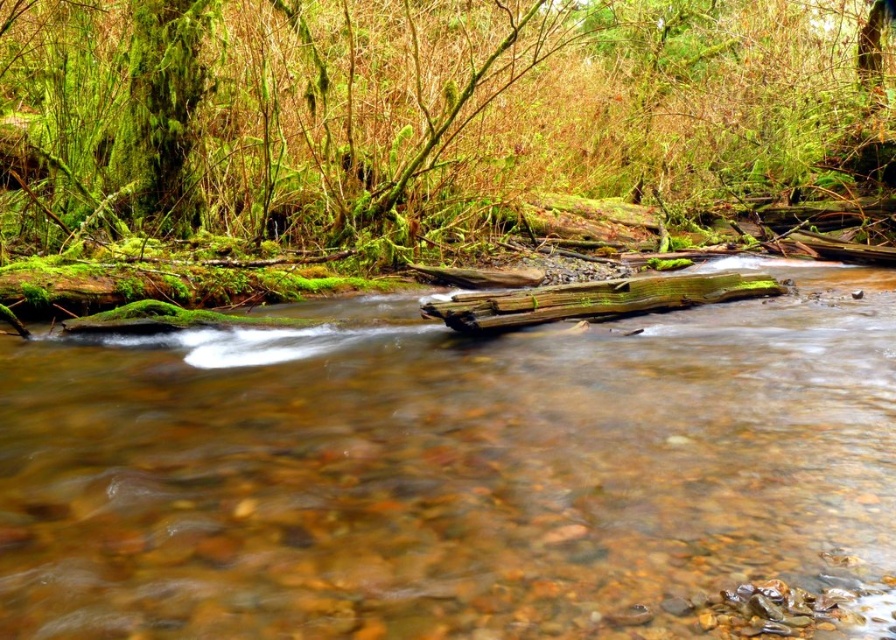
Does clear water at center have a greater height compared to green mossy log at upper center?

Incorrect, clear water at center's height is not larger of green mossy log at upper center's.

Looking at this image, between clear water at center and green mossy log at upper center, which one has less height?

clear water at center is shorter.

Describe the element at coordinates (448, 472) in the screenshot. I see `clear water at center` at that location.

The width and height of the screenshot is (896, 640). What are the coordinates of `clear water at center` in the screenshot? It's located at (448, 472).

Who is taller, green mossy log at upper center or green mossy log at center?

green mossy log at upper center is taller.

Is point (298, 204) farther from viewer compared to point (604, 300)?

Yes, point (298, 204) is behind point (604, 300).

At what (x,y) coordinates should I click in order to perform the action: click on green mossy log at upper center. Please return your answer as a coordinate pair (x, y). Looking at the image, I should click on (405, 108).

In the scene shown: Is clear water at center below green mossy log at center?

Correct, clear water at center is located below green mossy log at center.

This screenshot has height=640, width=896. What do you see at coordinates (448, 472) in the screenshot? I see `clear water at center` at bounding box center [448, 472].

Is point (412, 550) farther from camera compared to point (686, 282)?

No.

Identify the location of clear water at center. (448, 472).